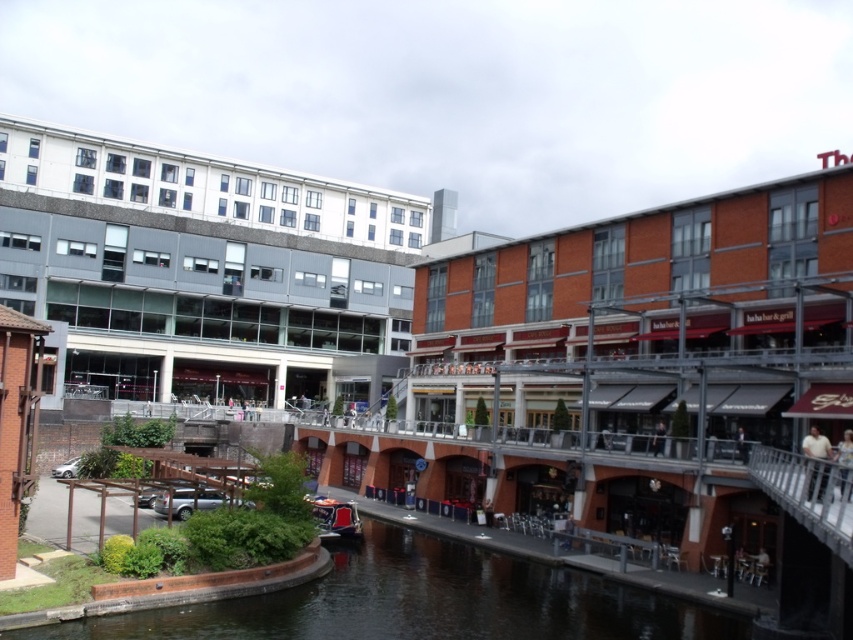
You are standing at the edge of the canal and want to place a small statue on the smooth concrete river at center so it can be seen from the metallic red boat at center. Will the statue be visible from the boat?

The smooth concrete river at center has a lesser height compared to metallic red boat at center, so the statue placed on the smooth concrete river at center will be visible from the boat since the boat is higher.

You are a delivery person needing to cross the smooth concrete river at center using the metallic red boat at center. Can the boat fit on the river?

The smooth concrete river at center might be wider than metallic red boat at center, so the boat should be able to fit on the river as the river is wider than the boat.